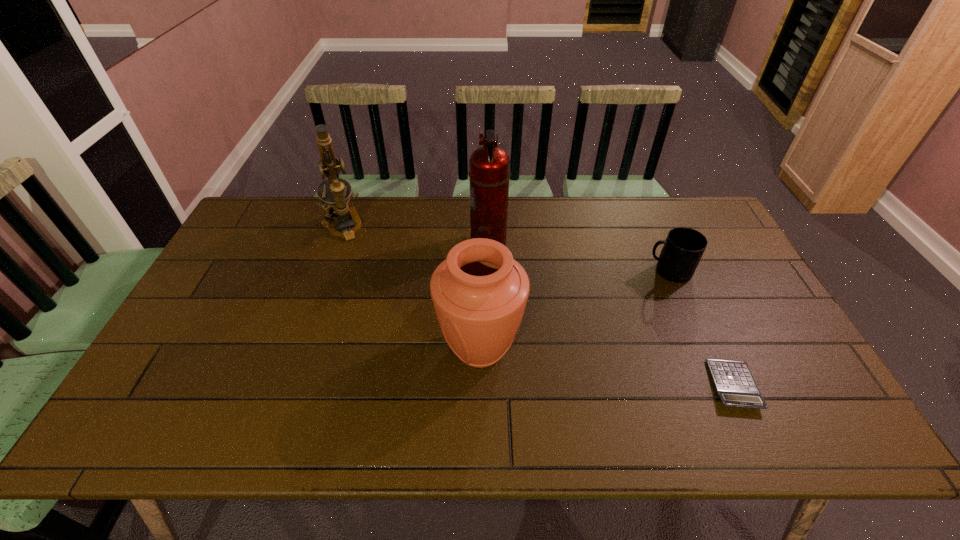
In order to click on fire extinguisher in this screenshot , I will do `click(489, 166)`.

In order to click on microscope in this screenshot , I will do `click(336, 202)`.

The width and height of the screenshot is (960, 540). In order to click on vase in this screenshot , I will do `click(479, 291)`.

Find the location of a particular element. The width and height of the screenshot is (960, 540). the second shortest object is located at coordinates (683, 248).

This screenshot has width=960, height=540. In order to click on the shortest object in this screenshot , I will do `click(734, 383)`.

Where is `vacant space located on the nozzle side of the fire extinguisher`? vacant space located on the nozzle side of the fire extinguisher is located at coordinates 349,245.

The width and height of the screenshot is (960, 540). In order to click on vacant space located 0.250m on the nozzle side of the fire extinguisher in this screenshot , I will do `click(393, 245)`.

You are a GUI agent. You are given a task and a screenshot of the screen. Output one action in this format:
    pyautogui.click(x=<x>, y=<y>)
    Task: Click on the free region located 0.380m on the nozzle side of the fire extinguisher
    The width and height of the screenshot is (960, 540).
    Given the screenshot: What is the action you would take?
    pyautogui.click(x=352, y=245)

Where is `vacant region located on the front of the microscope`? vacant region located on the front of the microscope is located at coordinates (317, 300).

Find the location of a particular element. The height and width of the screenshot is (540, 960). free space located 0.380m on the back of the third shortest object is located at coordinates (480, 229).